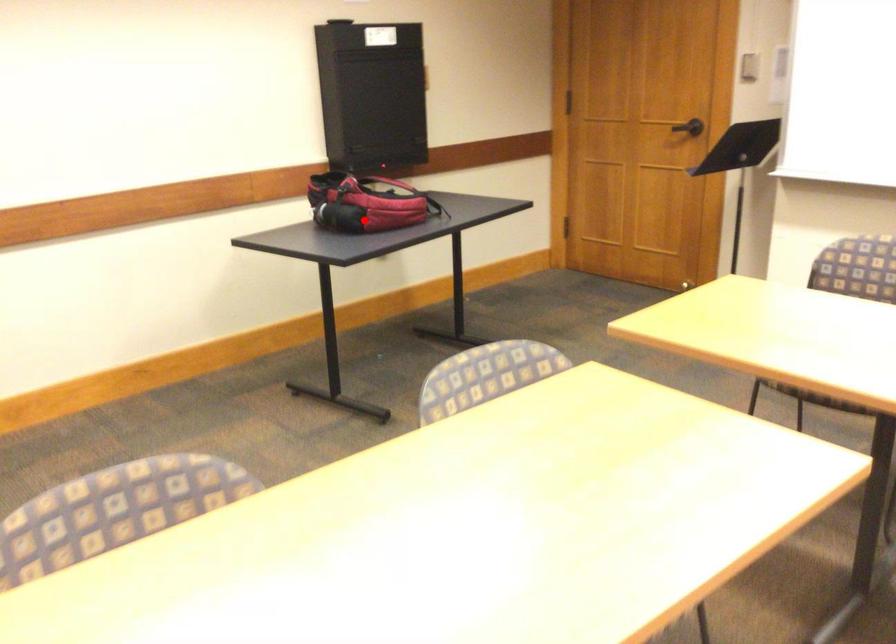
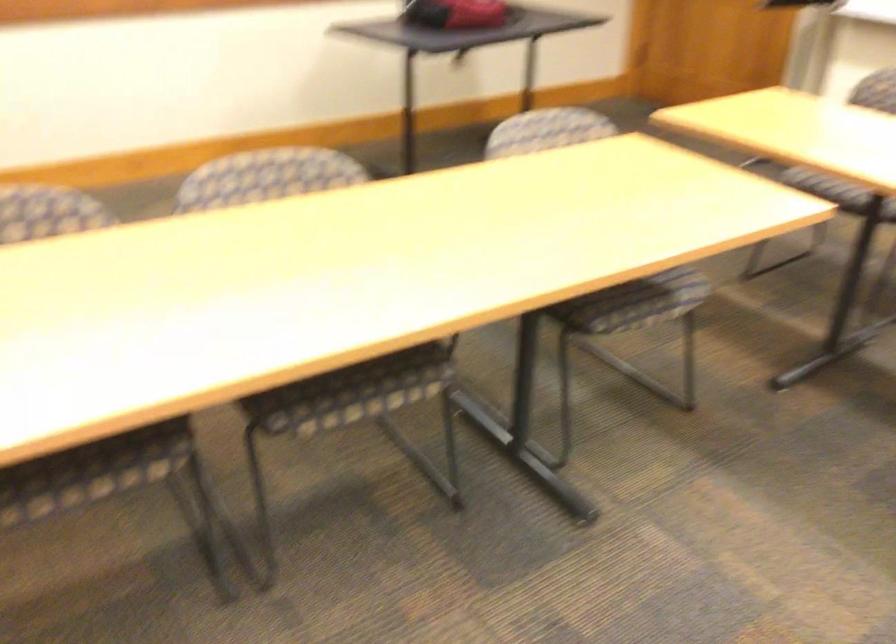
The point at the highlighted location is marked in the first image. Where is the corresponding point in the second image?

(455, 13)